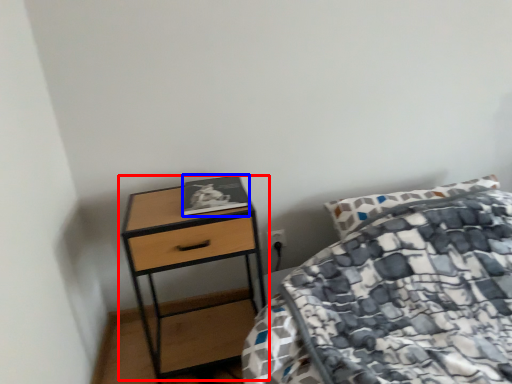
Question: Which of the following is the closest to the observer, table (highlighted by a red box) or book (highlighted by a blue box)?

Choices:
 (A) table
 (B) book

Answer: (A)